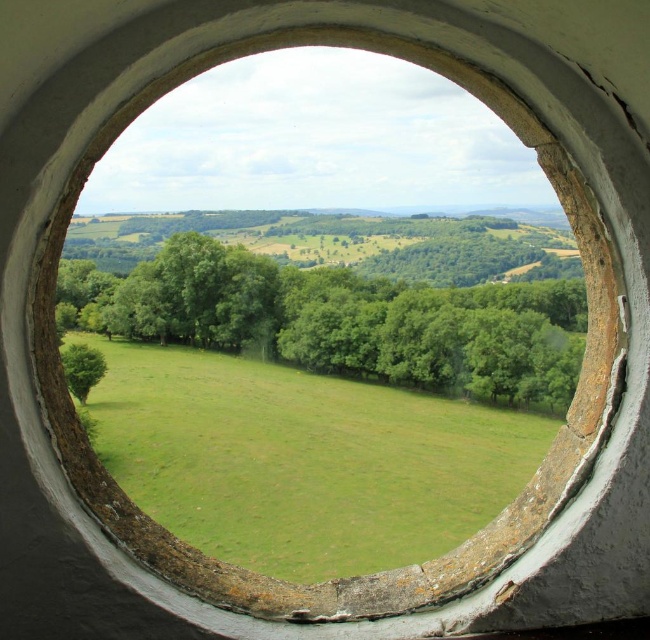
Question: Which point is closer to the camera?

Choices:
 (A) green grassy field at center
 (B) green leafy tree at center
 (C) green leafy tree at lower left

Answer: (C)

Question: Does green leafy tree at center appear over green leafy tree at lower left?

Choices:
 (A) yes
 (B) no

Answer: (A)

Question: Which point is closer to the camera taking this photo?

Choices:
 (A) (70, 356)
 (B) (512, 314)

Answer: (A)

Question: Does green grassy field at center appear over green leafy tree at center?

Choices:
 (A) no
 (B) yes

Answer: (A)

Question: Is green grassy field at center bigger than green leafy tree at lower left?

Choices:
 (A) yes
 (B) no

Answer: (A)

Question: Which of the following is the closest to the observer?

Choices:
 (A) green leafy tree at center
 (B) green grassy field at center

Answer: (B)